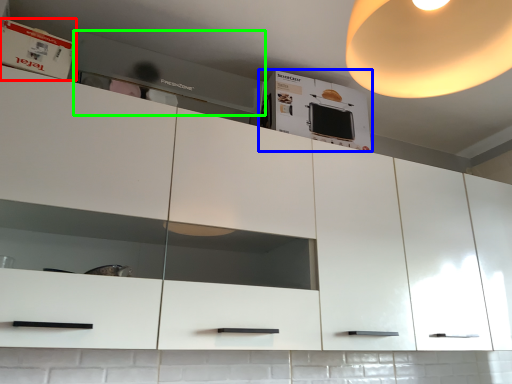
Question: Based on their relative distances, which object is nearer to cabinet (highlighted by a red box)? Choose from cabinetry (highlighted by a blue box) and home appliance (highlighted by a green box).

Choices:
 (A) cabinetry
 (B) home appliance

Answer: (B)